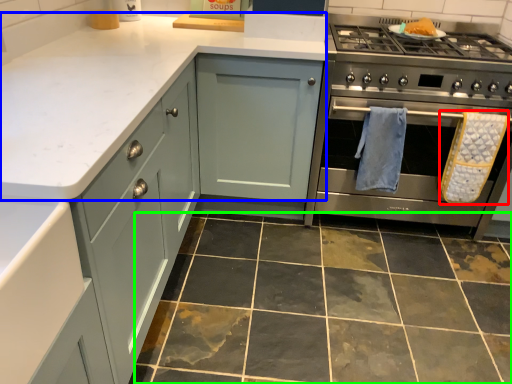
Question: Which is nearer to the bath towel (highlighted by a red box)? counter top (highlighted by a blue box) or ceramic tile (highlighted by a green box).

Choices:
 (A) counter top
 (B) ceramic tile

Answer: (B)